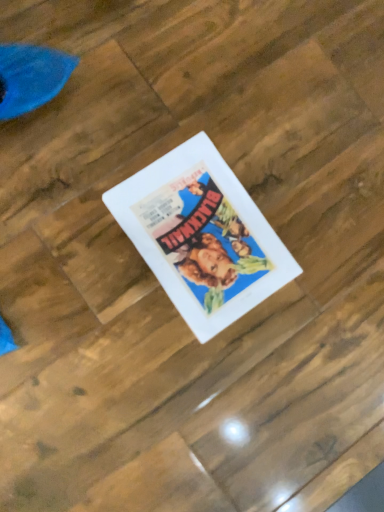
Locate an element on the screen. The height and width of the screenshot is (512, 384). vacant space that is to the left of white paper at center is located at coordinates (95, 145).